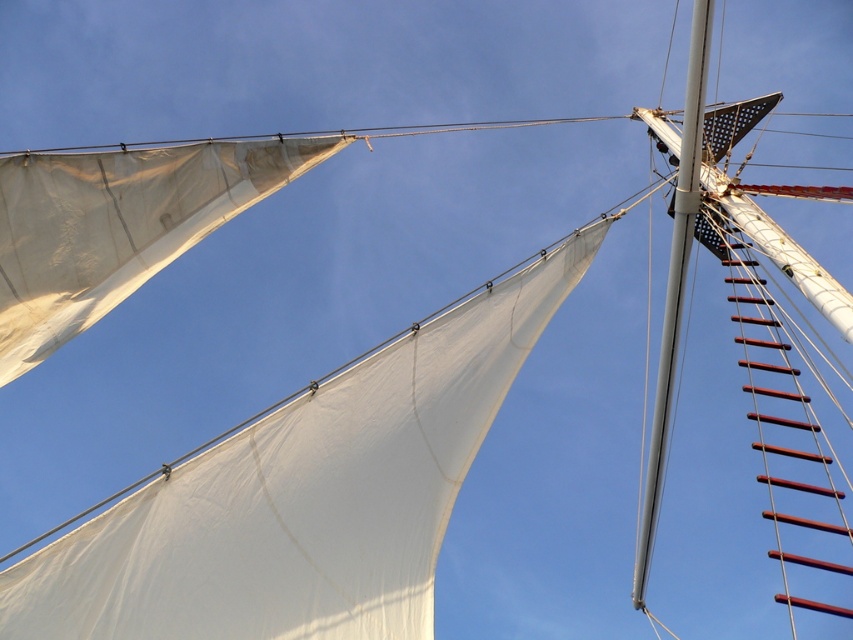
The width and height of the screenshot is (853, 640). What do you see at coordinates (793, 444) in the screenshot?
I see `rustic wood ladder at right` at bounding box center [793, 444].

Who is higher up, rustic wood ladder at right or silver metallic mast at upper right?

silver metallic mast at upper right is above.

Locate an element on the screen. The width and height of the screenshot is (853, 640). rustic wood ladder at right is located at coordinates click(793, 444).

You are a GUI agent. You are given a task and a screenshot of the screen. Output one action in this format:
    pyautogui.click(x=<x>, y=<y>)
    Task: Click on the rustic wood ladder at right
    The image size is (853, 640).
    Given the screenshot: What is the action you would take?
    pyautogui.click(x=793, y=444)